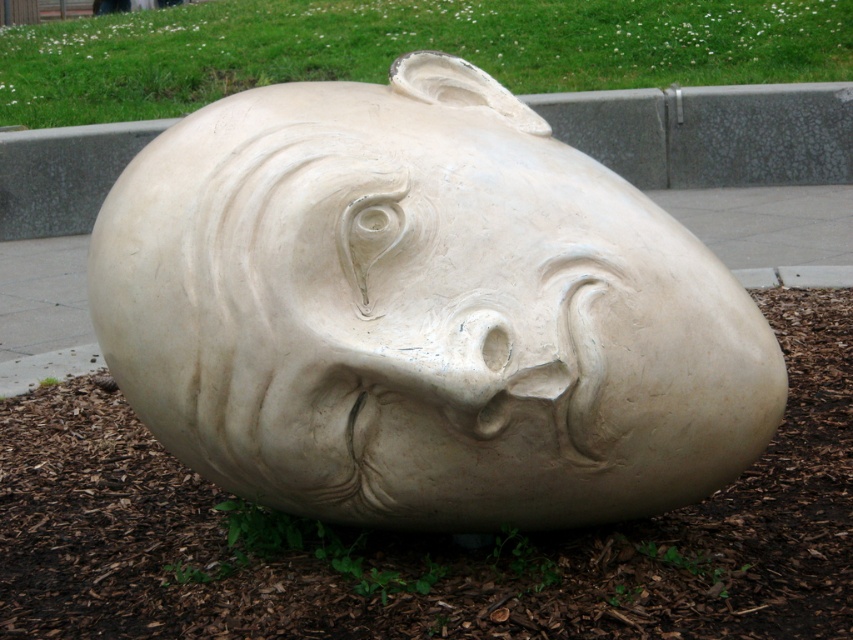
From the picture: You are a gardener who wants to plant a new flower bed near the white stone sculpture at center and the green grass at upper center. Since the sculpture is taller than the grass, where should you plant the flowers so they are visible from the front of the sculpture?

You should plant the flowers in front of the white stone sculpture at center because it is taller than the green grass at upper center, so placing them in front will ensure they are visible from the front of the sculpture.

You are a landscape designer planning to place a new bench in the garden. The bench requires a space wider than the green grass at upper center. Can the area next to the white stone sculpture at center accommodate the bench?

The white stone sculpture at center has a width larger than the green grass at upper center. Since the bench requires a space wider than the green grass at upper center, the area next to the white stone sculpture at center can accommodate the bench because it is wider.

You are a landscape designer planning to place a new garden ornament. You see the white stone sculpture at center and the green grass at upper center. Which object is located to the left of the other?

The white stone sculpture at center is positioned on the left side of green grass at upper center, so it is to the left of the green grass at upper center.